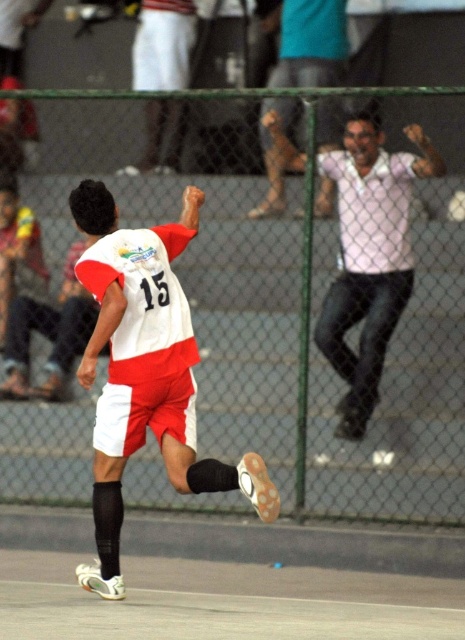
Does white matte soccer jersey at center have a greater width compared to white shirt at upper right?

No.

Does point (135, 252) come behind point (350, 323)?

No.

Does point (123, 401) come behind point (420, 150)?

No, (123, 401) is in front of (420, 150).

At what (x,y) coordinates should I click in order to perform the action: click on white matte soccer jersey at center. Please return your answer as a coordinate pair (x, y). This screenshot has width=465, height=640. Looking at the image, I should click on (145, 371).

What do you see at coordinates (369, 257) in the screenshot?
I see `white shirt at upper right` at bounding box center [369, 257].

Who is positioned more to the left, white shirt at upper right or white shirt at upper center?

From the viewer's perspective, white shirt at upper center appears more on the left side.

Measure the distance between white shirt at upper right and camera.

white shirt at upper right and camera are 30.36 feet apart.

The height and width of the screenshot is (640, 465). I want to click on white shirt at upper right, so click(x=369, y=257).

Which is behind, point (119, 314) or point (309, 58)?

Point (309, 58)

Which is more to the left, white matte soccer jersey at center or white shirt at upper center?

From the viewer's perspective, white matte soccer jersey at center appears more on the left side.

Image resolution: width=465 pixels, height=640 pixels. I want to click on white matte soccer jersey at center, so click(x=145, y=371).